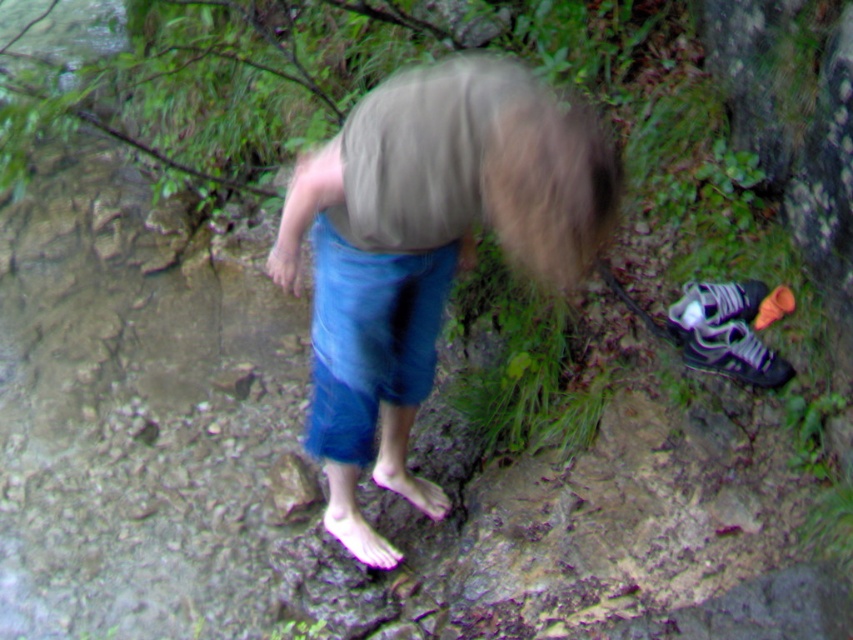
Who is more forward, (757, 348) or (758, 300)?

Point (757, 348) is more forward.

Is point (740, 349) farther from camera compared to point (683, 291)?

No, it is in front of (683, 291).

You are a GUI agent. You are given a task and a screenshot of the screen. Output one action in this format:
    pyautogui.click(x=<x>, y=<y>)
    Task: Click on the black mesh shoe at lower right
    This screenshot has width=853, height=640.
    Given the screenshot: What is the action you would take?
    pyautogui.click(x=733, y=353)